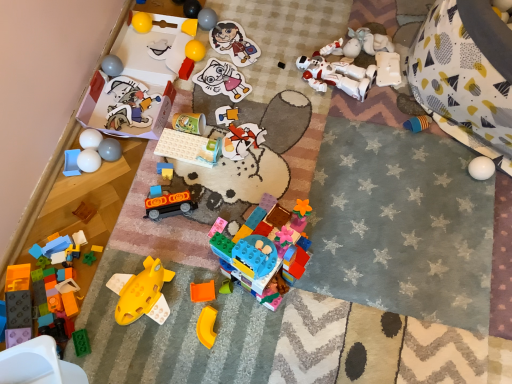
Image resolution: width=512 pixels, height=384 pixels. In order to click on vacant area that lies between matte plastic sticker at upper center, marked as the fourth toy in a right-to-left arrangement, and yellow matte plastic piece at center, the seventeenth toy viewed from the left in this screenshot , I will do `click(224, 150)`.